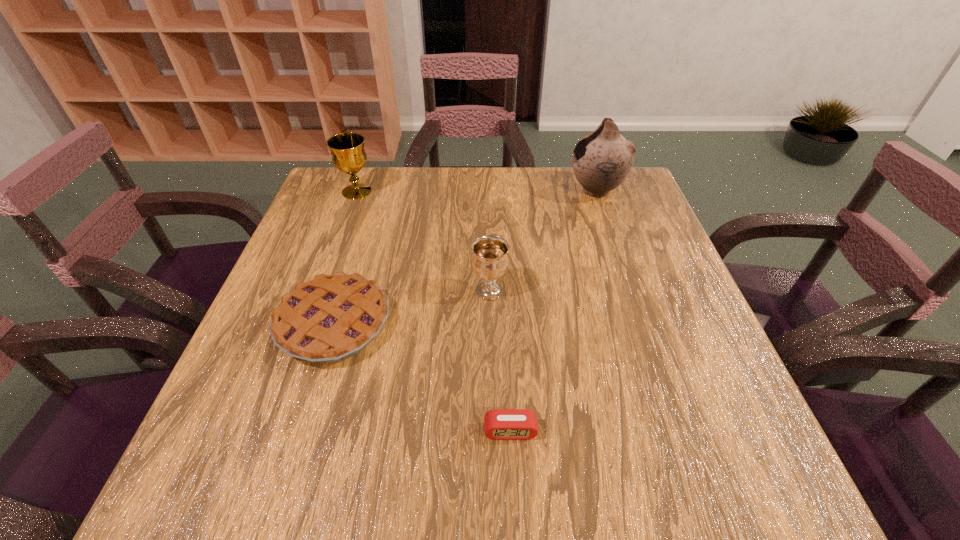
At what (x,y) coordinates should I click in order to perform the action: click on vacant point that satisfies the following two spatial constraints: 1. on the back side of the shorter chalice; 2. on the right side of the fourth tallest object. Please return your answer as a coordinate pair (x, y). This screenshot has width=960, height=540. Looking at the image, I should click on (345, 291).

Where is `free space in the image that satisfies the following two spatial constraints: 1. from the spout of the rightmost object; 2. on the front side of the second tallest object`? The image size is (960, 540). free space in the image that satisfies the following two spatial constraints: 1. from the spout of the rightmost object; 2. on the front side of the second tallest object is located at coordinates (596, 192).